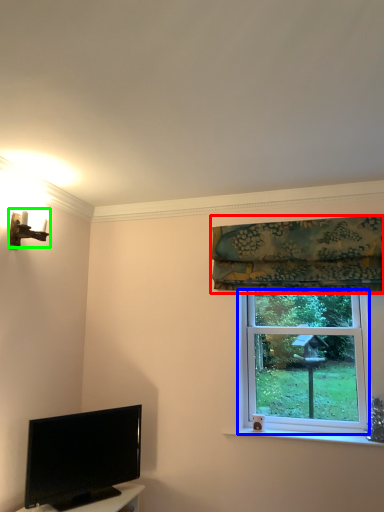
Question: Which object is positioned closest to curtain (highlighted by a red box)? Select from window screen (highlighted by a blue box) and light fixture (highlighted by a green box).

Choices:
 (A) window screen
 (B) light fixture

Answer: (A)